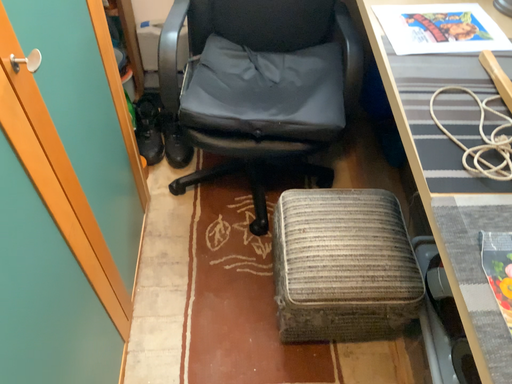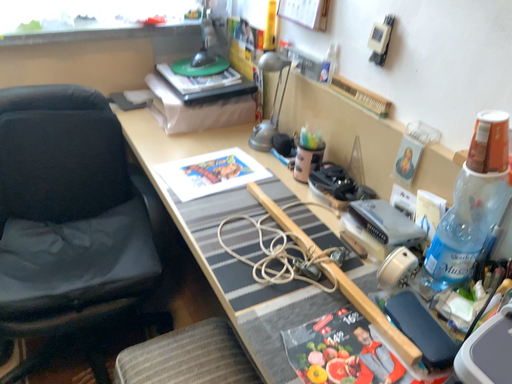
Question: How did the camera likely rotate when shooting the video?

Choices:
 (A) rotated right
 (B) rotated left

Answer: (A)